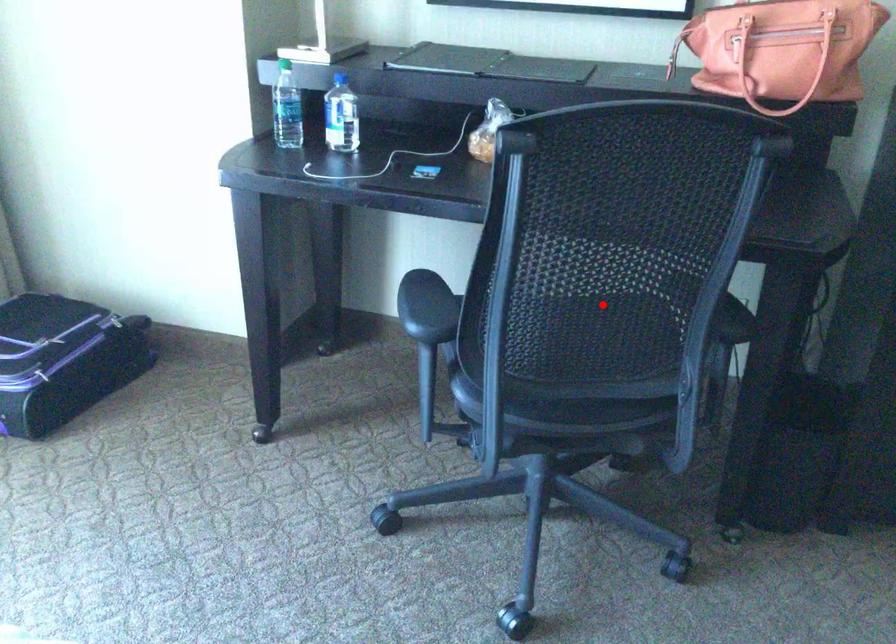
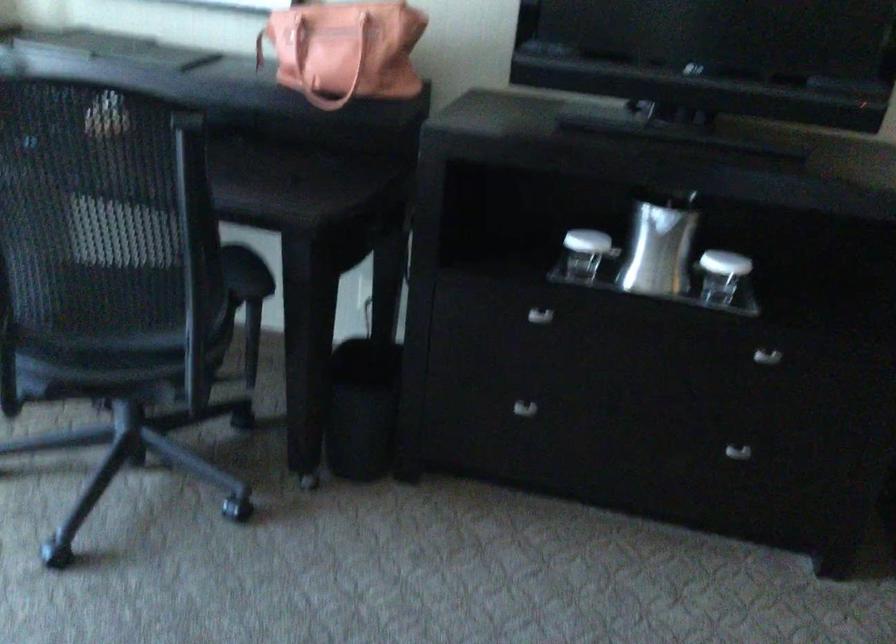
Question: I am providing you with two images of the same scene from different viewpoints. In image1, a red point is highlighted. Considering the same 3D point in image2, which of the following is correct?

Choices:
 (A) It is closer
 (B) It is farther

Answer: (B)